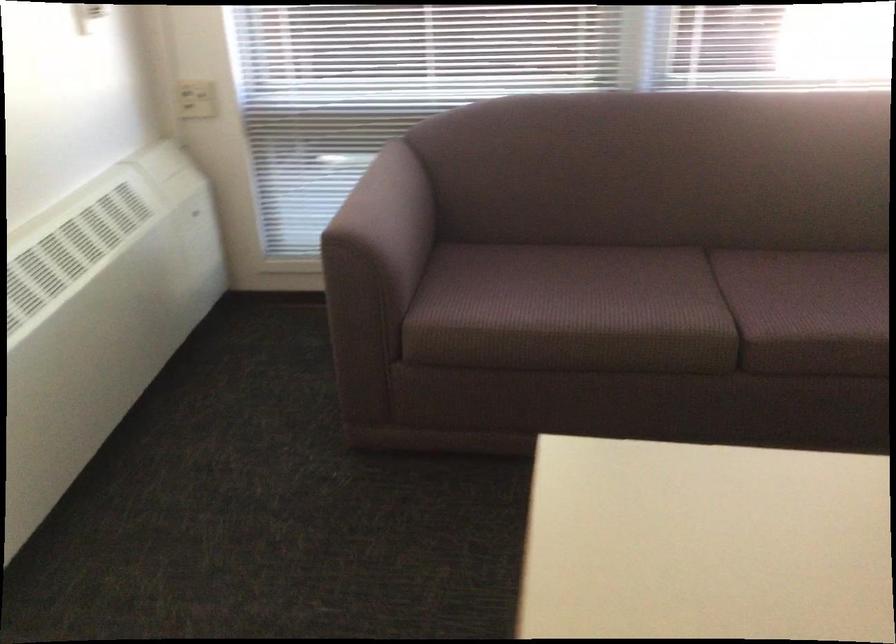
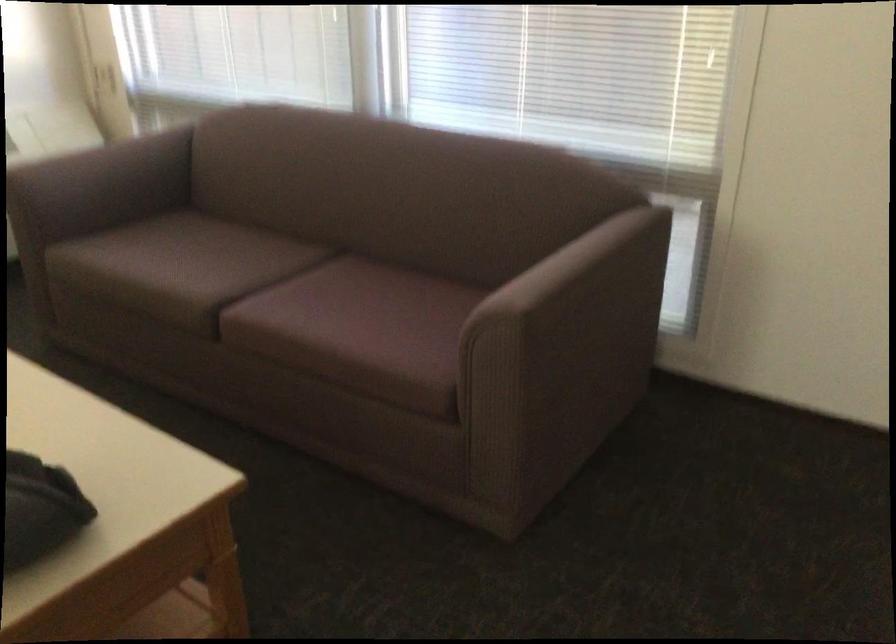
Where in the second image is the point corresponding to (x=418, y=212) from the first image?

(113, 173)